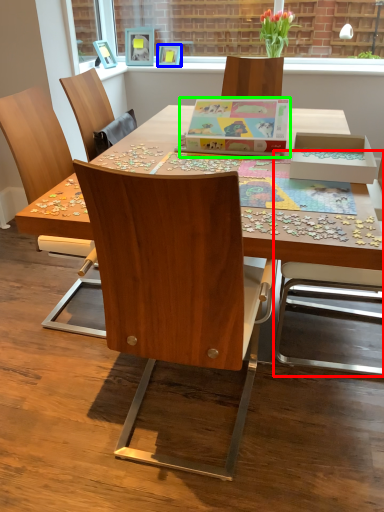
Question: Estimate the real-world distances between objects in this image. Which object is closer to chair (highlighted by a red box), picture frame (highlighted by a blue box) or cardboard box (highlighted by a green box)?

Choices:
 (A) picture frame
 (B) cardboard box

Answer: (B)